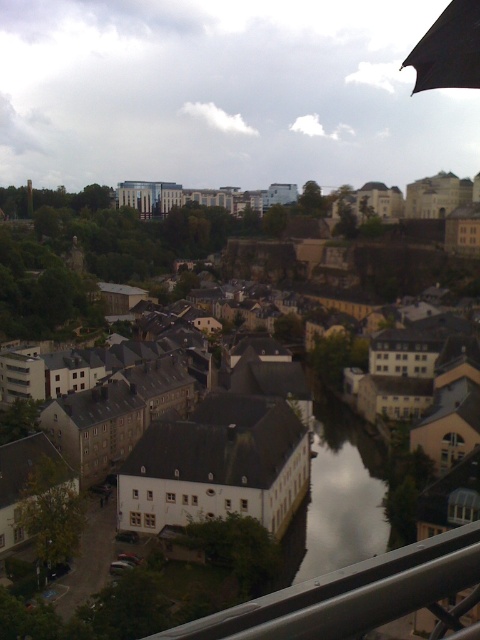
Question: Which object is positioned closest to the silver metallic rail at lower center?

Choices:
 (A) light beige stone buildings at center
 (B) clear glass waterway at center

Answer: (B)

Question: Can you confirm if light beige stone buildings at center is positioned to the right of clear glass waterway at center?

Choices:
 (A) yes
 (B) no

Answer: (B)

Question: Which of the following is the farthest from the observer?

Choices:
 (A) light beige stone buildings at center
 (B) silver metallic rail at lower center

Answer: (A)

Question: Which object appears closest to the camera in this image?

Choices:
 (A) light beige stone buildings at center
 (B) silver metallic rail at lower center
 (C) clear glass waterway at center
 (D) black matte umbrella at upper right

Answer: (B)

Question: Does light beige stone buildings at center lie in front of black matte umbrella at upper right?

Choices:
 (A) yes
 (B) no

Answer: (A)

Question: Is light beige stone buildings at center thinner than silver metallic rail at lower center?

Choices:
 (A) no
 (B) yes

Answer: (A)